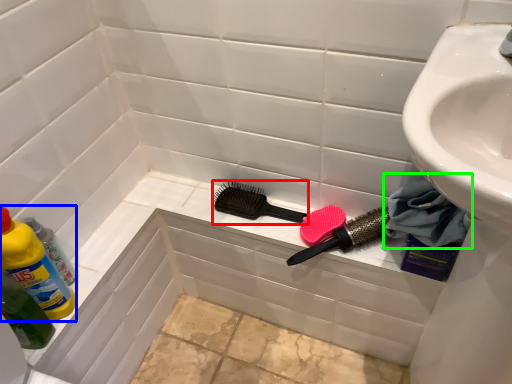
Question: Based on their relative distances, which object is farther from brush (highlighted by a red box)? Choose from cleaning product (highlighted by a blue box) and material (highlighted by a green box).

Choices:
 (A) cleaning product
 (B) material

Answer: (A)